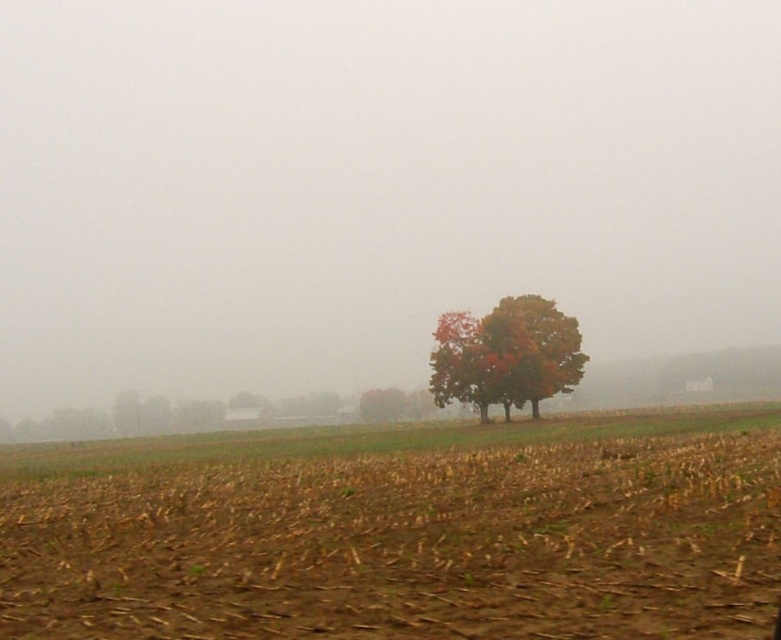
Is brown soil at lower center positioned in front of autumn leaves tree at center?

Yes, brown soil at lower center is in front of autumn leaves tree at center.

Is brown soil at lower center shorter than autumn leaves tree at center?

Indeed, brown soil at lower center has a lesser height compared to autumn leaves tree at center.

At what (x,y) coordinates should I click in order to perform the action: click on brown soil at lower center. Please return your answer as a coordinate pair (x, y). Image resolution: width=781 pixels, height=640 pixels. Looking at the image, I should click on (405, 545).